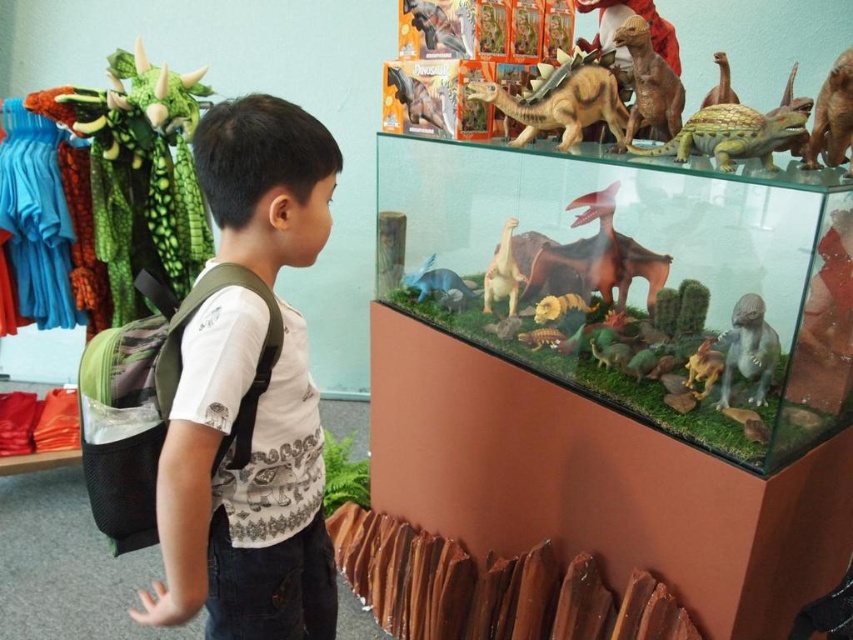
You are a GUI agent. You are given a task and a screenshot of the screen. Output one action in this format:
    pyautogui.click(x=<x>, y=<y>)
    Task: Click on the brown matte dinosaur at center
    
    Given the screenshot: What is the action you would take?
    pyautogui.click(x=561, y=106)

Is point (606, 96) farther from viewer compared to point (827, 118)?

That is True.

Identify the location of brown matte dinosaur at center. Image resolution: width=853 pixels, height=640 pixels. (561, 106).

Can you confirm if brown matte dinosaur at upper center is bigger than matte brown dinosaur at center?

Correct, brown matte dinosaur at upper center is larger in size than matte brown dinosaur at center.

This screenshot has width=853, height=640. What do you see at coordinates (648, 84) in the screenshot? I see `brown matte dinosaur at upper center` at bounding box center [648, 84].

Where is `brown matte dinosaur at upper center`? The height and width of the screenshot is (640, 853). brown matte dinosaur at upper center is located at coordinates (648, 84).

From the picture: Which of these two, brown plastic dinosaur at upper center or brown matte dinosaur at upper center, stands taller?

Standing taller between the two is brown plastic dinosaur at upper center.

Describe the element at coordinates (602, 381) in the screenshot. I see `brown plastic dinosaur at upper center` at that location.

Which is behind, point (590, 204) or point (665, 116)?

The point (590, 204) is behind.

Image resolution: width=853 pixels, height=640 pixels. Find the location of `brown plastic dinosaur at upper center`. brown plastic dinosaur at upper center is located at coordinates (602, 381).